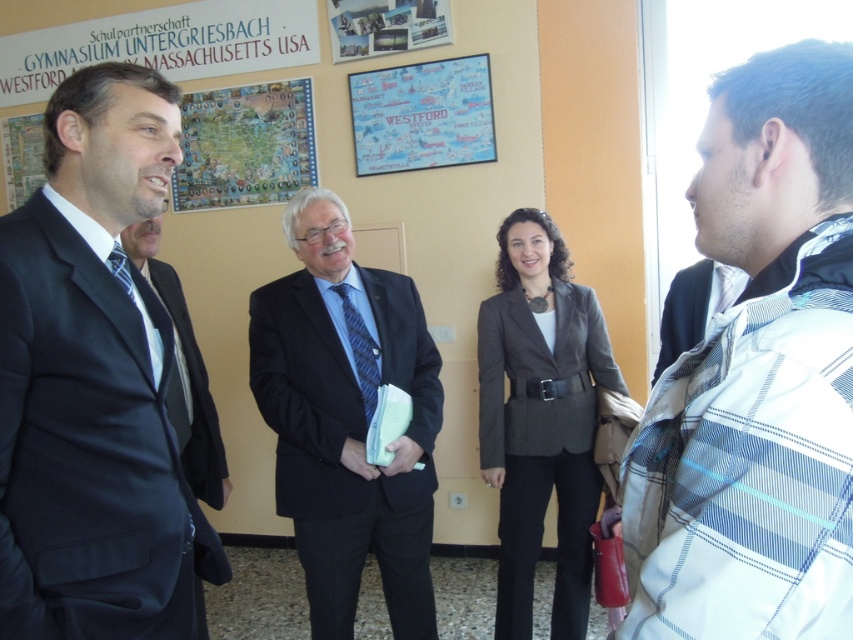
You are an event planner organizing a photoshoot for a fashion magazine. You need to arrange two models wearing the black matte suit at left and dark blue fabric business suit at right. Since you want to emphasize the contrast in their sizes, which model should stand closer to the camera?

The black matte suit at left is larger in size compared to the dark blue fabric business suit at right. To emphasize the size contrast, the model wearing the black matte suit at left should stand closer to the camera so that their larger size is more prominent against the background.

You are a photographer setting up for a group photo. You need to ensure that the white plaid jacket at right and the black matte suit at left are both in frame. Given that the camera has a fixed focal length, which subject should you adjust closer to the camera to maintain both in the frame without zooming?

Since the white plaid jacket at right has a lesser width compared to the black matte suit at left, you should move the white plaid jacket at right closer to the camera. This adjustment will help balance their sizes in the frame, ensuring both are visible without needing to zoom.

You are a photographer setting up for a group photo. You need to position the white plaid jacket at right and the black matte suit at left in such a way that both are clearly visible. Considering their sizes, which object should be placed closer to the camera to ensure proper visibility?

The white plaid jacket at right is smaller in size compared to the black matte suit at left. To ensure both are clearly visible, the white plaid jacket at right should be placed closer to the camera so its smaller size is adequately captured.